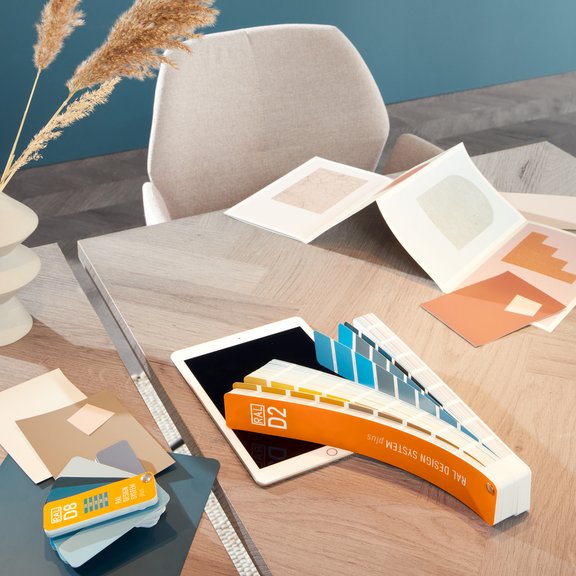
Locate an element on the screen. This screenshot has height=576, width=576. blue wall is located at coordinates (400, 26).